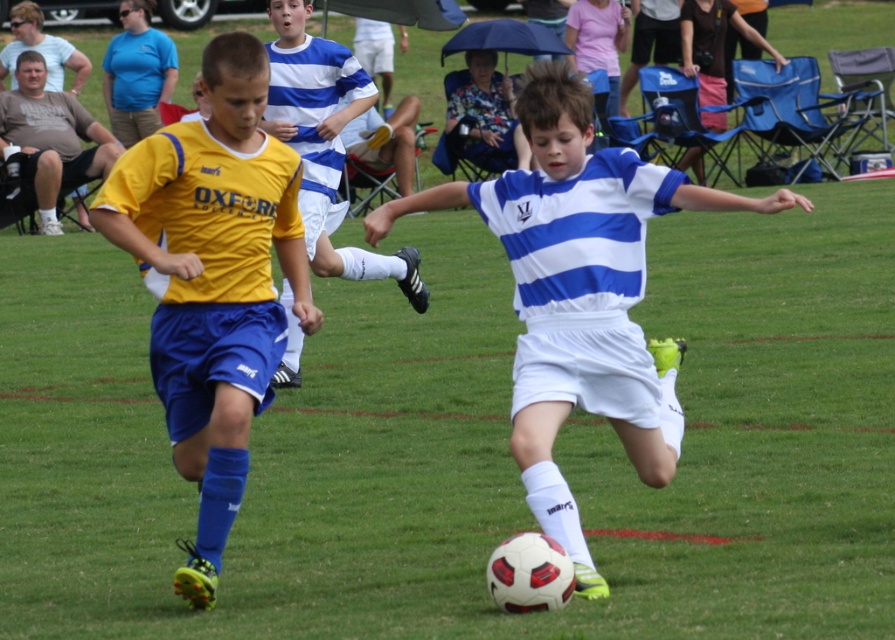
You are a soccer coach analyzing a play from above. The ball is at the center of the field. Where is the yellow matte jersey at left positioned relative to the ball?

The yellow matte jersey at left is located at coordinates approximately 0.439 along the x axis and 0.238 along the y axis, which places it to the left and slightly forward of the ball at the center.

You are a soccer coach analyzing a play. The ball is at the center of the field. You see a point marked at coordinates (580, 292). Is this point where the ball is located?

Yes, the point marked at coordinates (580, 292) corresponds to the white matte soccer ball at center, so the ball is indeed located at that point.

Consider the image. You are a referee positioned at the center circle of the soccer field. You need to quickly assess if the yellow matte jersey at left and the blue striped jersey at center are within the 4 meters penalty distance for a foul. Can you confirm if they are within the required distance?

The distance between the yellow matte jersey at left and the blue striped jersey at center is 3.65 meters, which is within the 4 meters penalty distance requirement. Therefore, they are within the required distance.